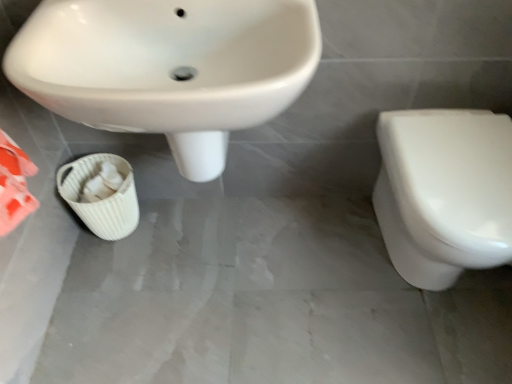
Where is `vacant space situated on the left part of white glossy toilet at right`? This screenshot has width=512, height=384. vacant space situated on the left part of white glossy toilet at right is located at coordinates (312, 267).